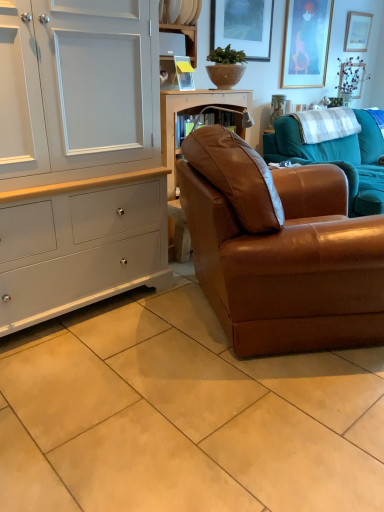
Question: Considering the relative positions of white checkered blanket at upper right and brown leather couch at center, the first studio couch when ordered from back to front, in the image provided, is white checkered blanket at upper right to the left or to the right of brown leather couch at center, the first studio couch when ordered from back to front,?

Choices:
 (A) left
 (B) right

Answer: (A)

Question: Is white checkered blanket at upper right bigger or smaller than brown leather couch at center, the first studio couch when ordered from back to front?

Choices:
 (A) small
 (B) big

Answer: (A)

Question: Which is farther from the white checkered blanket at upper right?

Choices:
 (A) gold-framed picture at upper right, which is the 2th picture frame from front to back
 (B) white painted wood cabinet at left
 (C) brown leather couch at center, placed as the 2th studio couch when sorted from front to back
 (D) wooden picture frame at upper right, the 3th picture frame positioned from the left
 (E) green matte vase at upper right

Answer: (B)

Question: Estimate the real-world distances between objects in this image. Which object is closer to the white painted wood cabinet at left?

Choices:
 (A) white wood shelf at upper center, which appears as the second shelf when ordered from the bottom
 (B) white checkered blanket at upper right
 (C) white plastic shelf at upper center, marked as the 2th shelf in a top-to-bottom arrangement
 (D) brown leather couch at center, placed as the 2th studio couch when sorted from front to back
 (E) beige ceramic tile at lower center

Answer: (E)